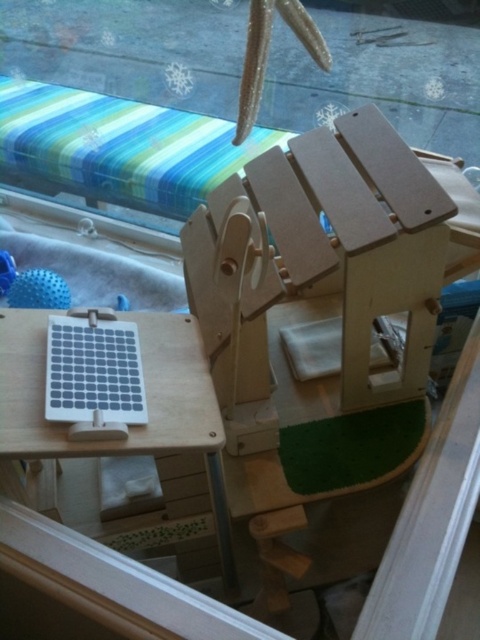
You are setting up a small animal play area and need to place a toy that requires a surface wider than the white matte solar panel at lower left. Can the wooden table at lower left accommodate it?

The wooden table at lower left might be wider than the white matte solar panel at lower left, so it could potentially accommodate the toy requiring a wider surface.

You are holding a small toy that is 2 inches in diameter and want to place it near the point at coordinates (239, 284) on the wooden play structure. If the toy needs to be placed exactly at that point, will it fit without overlapping any other parts of the structure?

The point at coordinates (239, 284) is 33.04 inches away from the viewer. Since the toy is only 2 inches in diameter, it can be placed there without overlapping other parts of the structure as there is sufficient space.

You are a small animal navigating the play structure. You need to move from the white matte solar panel at lower left to the wooden table at lower left. Which direction should you move?

The wooden table at lower left is to the right of the white matte solar panel at lower left, so you should move to the right to reach it.